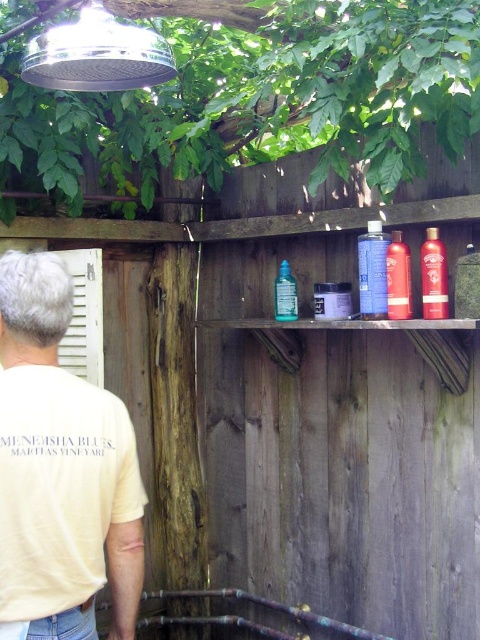
Question: Which object is farther from the camera taking this photo?

Choices:
 (A) yellow cotton t-shirt at lower left
 (B) translucent glass bottle at center
 (C) blue matte spray can at upper center

Answer: (B)

Question: Is translucent plastic bottles at upper center in front of red matte hair spray at upper center?

Choices:
 (A) yes
 (B) no

Answer: (A)

Question: Which object appears closest to the camera in this image?

Choices:
 (A) translucent plastic bottles at upper center
 (B) red matte hair spray at upper center
 (C) yellow cotton t-shirt at lower left
 (D) translucent glass bottle at center

Answer: (C)

Question: In this image, where is shiny red bottle at upper right located relative to red matte hair spray at upper center?

Choices:
 (A) above
 (B) below

Answer: (A)

Question: Is translucent plastic bottles at upper center bigger than shiny red bottle at upper right?

Choices:
 (A) no
 (B) yes

Answer: (B)

Question: Which point is farther to the camera?

Choices:
 (A) yellow cotton t-shirt at lower left
 (B) shiny red bottle at upper right
 (C) translucent plastic bottles at upper center
 (D) blue matte spray can at upper center

Answer: (D)